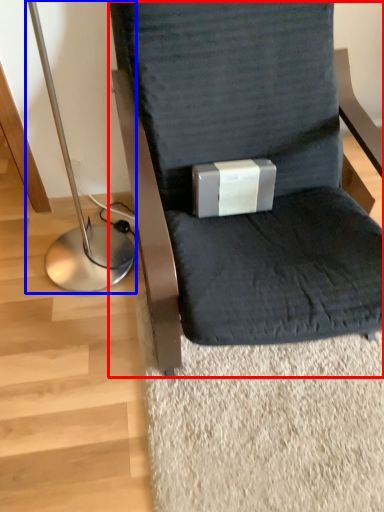
Question: Which of the following is the closest to the observer, chair (highlighted by a red box) or bedside lamp (highlighted by a blue box)?

Choices:
 (A) chair
 (B) bedside lamp

Answer: (A)